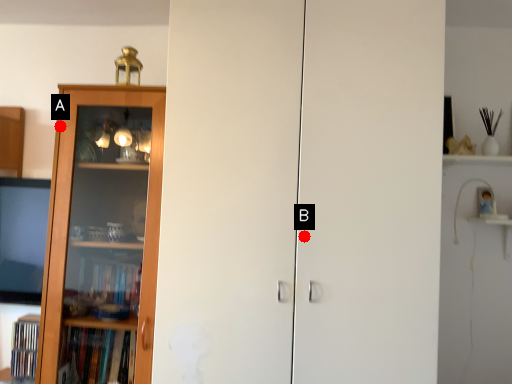
Question: Two points are circled on the image, labeled by A and B beside each circle. Among these points, which one is farthest from the camera?

Choices:
 (A) A is further
 (B) B is further

Answer: (A)